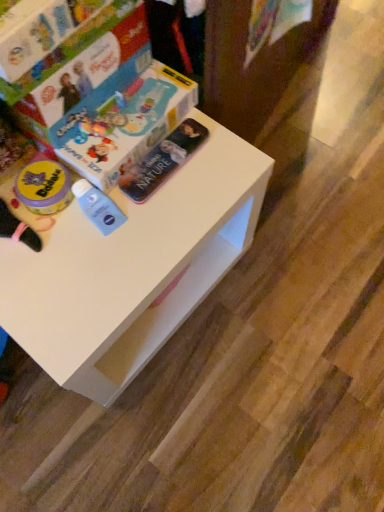
Identify the location of vacant space to the right of white matte table at center. (299, 281).